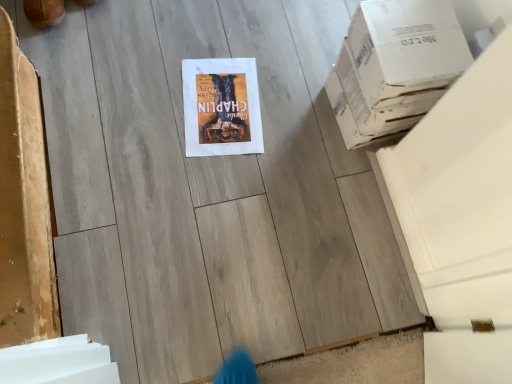
What do you see at coordinates (394, 67) in the screenshot? I see `white cardboard box at upper right` at bounding box center [394, 67].

Image resolution: width=512 pixels, height=384 pixels. I want to click on white cardboard box at upper right, so click(394, 67).

Find the location of a particular element. The image size is (512, 384). white cardboard box at upper right is located at coordinates (394, 67).